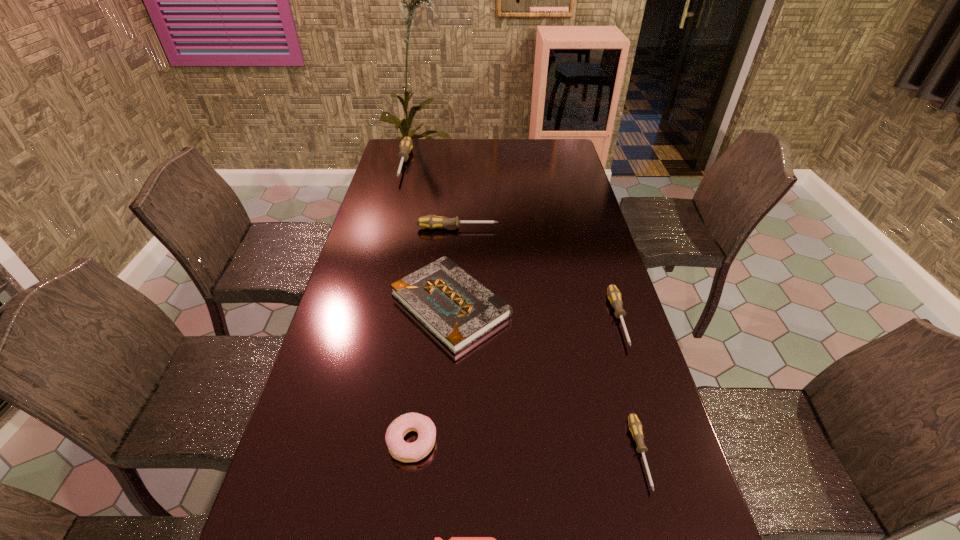
Where is `blank space at the left edge of the desktop`? Image resolution: width=960 pixels, height=540 pixels. blank space at the left edge of the desktop is located at coordinates (293, 472).

Find the location of a particular element. This screenshot has height=540, width=960. free space at the right edge of the desktop is located at coordinates (619, 285).

Where is `vacant area at the far left corner`? This screenshot has width=960, height=540. vacant area at the far left corner is located at coordinates (420, 156).

At what (x,y) coordinates should I click in order to perform the action: click on free space at the far right corner of the desktop. Please return your answer as a coordinate pair (x, y). This screenshot has width=960, height=540. Looking at the image, I should click on (544, 150).

Where is `unoccupied area between the rightmost screwdriver and the third gray screwdriver from left to right`? The width and height of the screenshot is (960, 540). unoccupied area between the rightmost screwdriver and the third gray screwdriver from left to right is located at coordinates (630, 386).

The image size is (960, 540). Identify the location of object that stands as the closest to the third farthest gray screwdriver. (635, 426).

In order to click on object identified as the fourth closest to the pink doughnut in this screenshot , I will do `click(614, 295)`.

Image resolution: width=960 pixels, height=540 pixels. In order to click on screwdriver object that ranks as the second closest to the third smallest gray screwdriver in this screenshot , I will do `click(614, 295)`.

Identify which screwdriver is located as the third nearest to the smallest gray screwdriver. Please provide its 2D coordinates. Your answer should be formatted as a tuple, i.e. [(x, y)], where the tuple contains the x and y coordinates of a point satisfying the conditions above.

[(431, 221)]

The height and width of the screenshot is (540, 960). What are the coordinates of `the closest gray screwdriver to the second farthest screwdriver` in the screenshot? It's located at (406, 145).